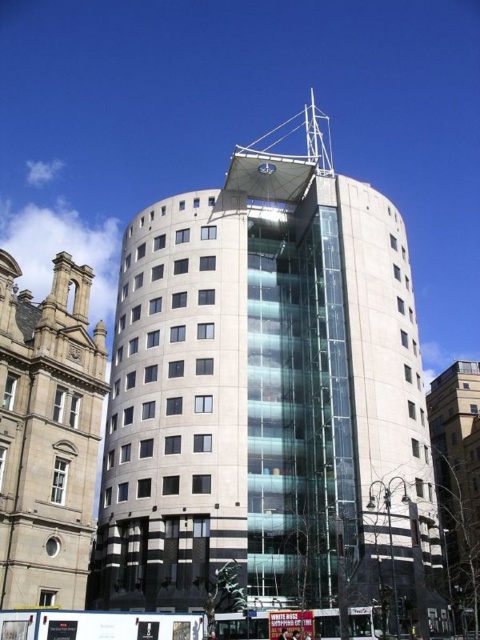
Question: Which point is farther from the camera taking this photo?

Choices:
 (A) (40, 477)
 (B) (226, 268)

Answer: (B)

Question: Which object appears farthest from the camera in this image?

Choices:
 (A) white glass building at center
 (B) stone building at left

Answer: (A)

Question: Can you confirm if white glass building at center is positioned above stone building at left?

Choices:
 (A) yes
 (B) no

Answer: (A)

Question: Can you confirm if white glass building at center is thinner than stone building at left?

Choices:
 (A) yes
 (B) no

Answer: (B)

Question: Does white glass building at center have a larger size compared to stone building at left?

Choices:
 (A) yes
 (B) no

Answer: (A)